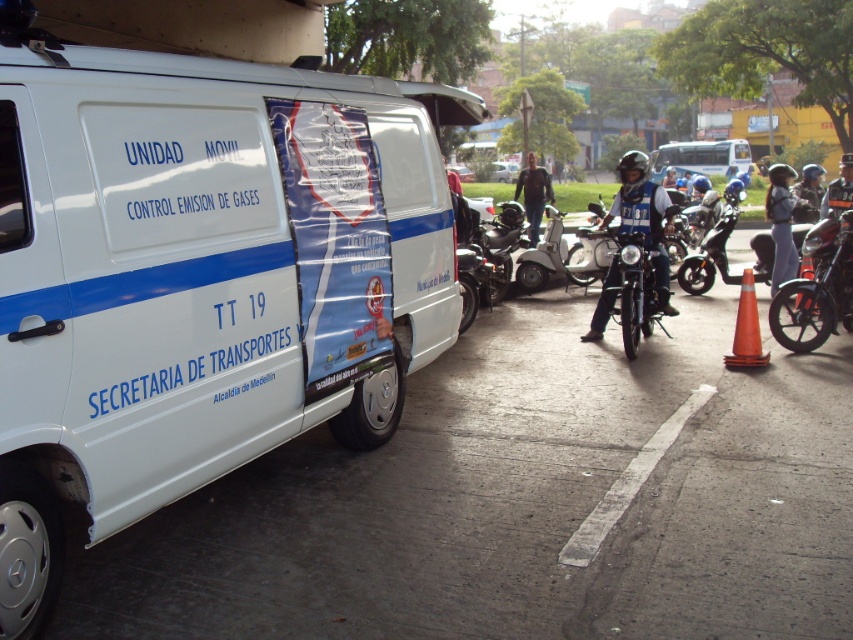
Does white matte van at left appear over orange matte traffic cone at lower right?

Indeed, white matte van at left is positioned over orange matte traffic cone at lower right.

What do you see at coordinates (199, 275) in the screenshot? The image size is (853, 640). I see `white matte van at left` at bounding box center [199, 275].

This screenshot has width=853, height=640. Find the location of `white matte van at left`. white matte van at left is located at coordinates coord(199,275).

Is blue uniform at center smaller than shiny black motorcycle at center?

Yes, blue uniform at center is smaller than shiny black motorcycle at center.

The image size is (853, 640). Find the location of `blue uniform at center`. blue uniform at center is located at coordinates (643, 216).

Between point (630, 224) and point (727, 225), which one is positioned behind?

Positioned behind is point (727, 225).

What are the coordinates of `blue uniform at center` in the screenshot? It's located at (643, 216).

Does shiny black motorcycle at right have a greater width compared to shiny black motorcycle at center?

No, shiny black motorcycle at right is not wider than shiny black motorcycle at center.

In the scene shown: Is shiny black motorcycle at right above shiny black motorcycle at center?

No.

You are a GUI agent. You are given a task and a screenshot of the screen. Output one action in this format:
    pyautogui.click(x=<x>, y=<y>)
    Task: Click on the shiny black motorcycle at right
    This screenshot has width=853, height=640.
    Given the screenshot: What is the action you would take?
    pyautogui.click(x=817, y=289)